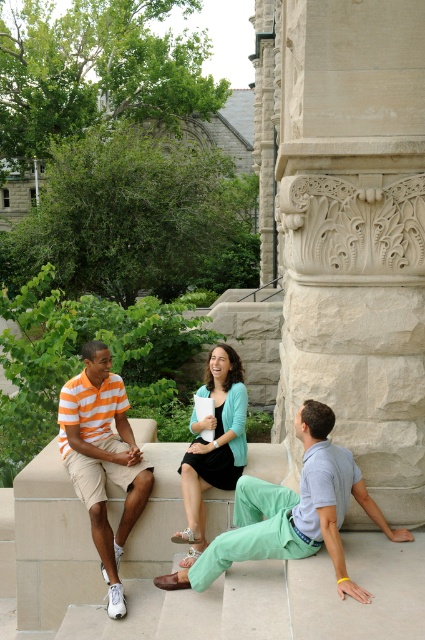
In the scene shown: You are an observer standing in front of the scene. You notice two items of clothing, the light green cotton pants at center and the orange striped shirt at left. Which clothing item has a greater width?

The light green cotton pants at center has a greater width than the orange striped shirt at left according to the description.

You are standing at the origin point of the coordinate system in the scene. You need to move towards the light green cotton pants at center. What direction should you move in to reach them?

The light green cotton pants at center is located at coordinate point 0.802 in the x direction and 0.687 in the y direction. Since you are at the origin, you should move towards the positive x and positive y directions to reach them.

You are standing in front of the stone ledge where the three people are sitting. You want to place a small potted plant between the two points marked as point (329,480) and point (221,476). Which point should the plant be closer to in order to be nearer to the person on the left?

The plant should be closer to point (221,476) because point (329,480) is closer to the camera than point (221,476), meaning point (221,476) is further back and thus nearer to the person on the left who is sitting on the stone ledge.